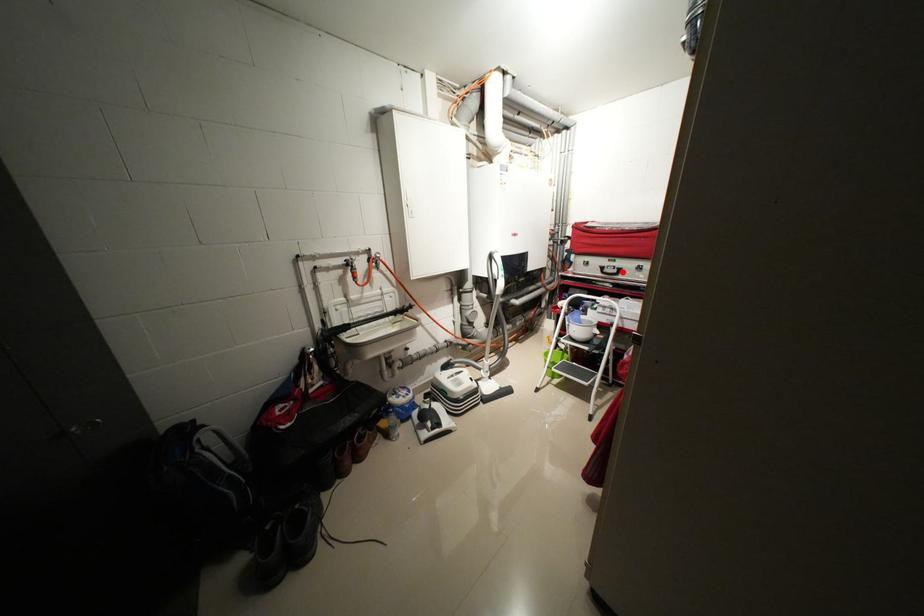
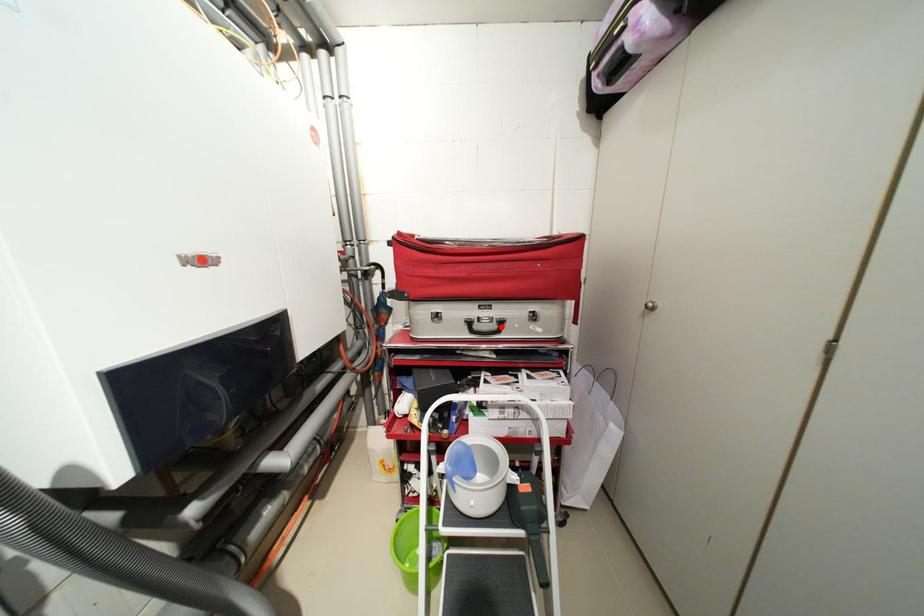
I am providing you with two images of the same scene from different viewpoints. A red point is marked on the first image and another point is marked on the second image. Is the marked point in image1 the same physical position as the marked point in image2?

A: Yes